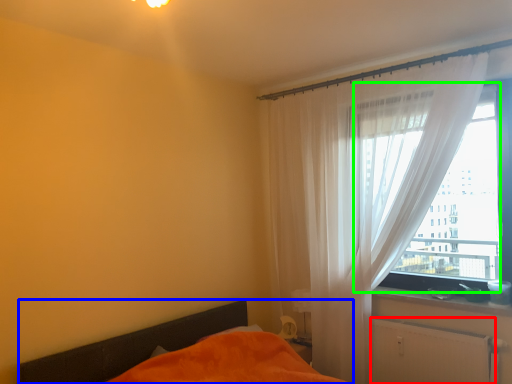
Question: Which object is the closest to the radiator (highlighted by a red box)? Choose among these: bed (highlighted by a blue box) or window (highlighted by a green box).

Choices:
 (A) bed
 (B) window

Answer: (B)